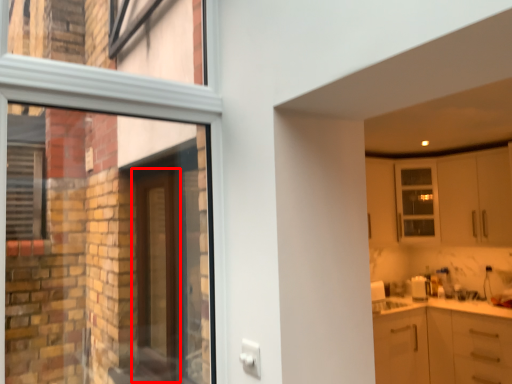
Question: In this image, where is door (annotated by the red box) located relative to cabinetry?

Choices:
 (A) right
 (B) left

Answer: (B)